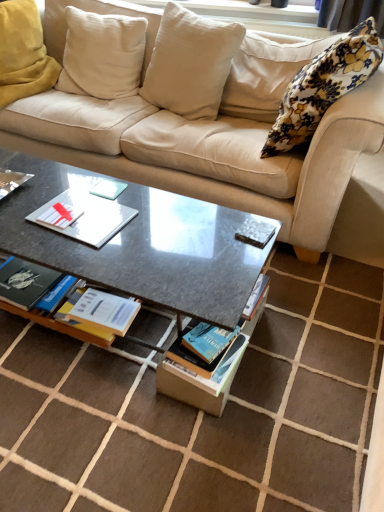
You are a GUI agent. You are given a task and a screenshot of the screen. Output one action in this format:
    pyautogui.click(x=<x>, y=<y>)
    Task: Click on the floral fabric pillow at upper right, the fourth pillow positioned from the left
    
    Given the screenshot: What is the action you would take?
    pyautogui.click(x=323, y=86)

Locate an element on the screen. This screenshot has width=384, height=512. metallic silver book at left, which is the 2th book in bottom-to-top order is located at coordinates (11, 181).

Image resolution: width=384 pixels, height=512 pixels. Describe the element at coordinates (142, 245) in the screenshot. I see `granite gray coffee table at center` at that location.

This screenshot has width=384, height=512. Describe the element at coordinates (190, 63) in the screenshot. I see `white cotton pillow at upper center, which is the 2th pillow from right to left` at that location.

You are a GUI agent. You are given a task and a screenshot of the screen. Output one action in this format:
    pyautogui.click(x=<x>, y=<y>)
    Task: Click on the white matte paper at center
    The height and width of the screenshot is (512, 384).
    Given the screenshot: What is the action you would take?
    pyautogui.click(x=84, y=217)

This screenshot has width=384, height=512. I want to click on beige fabric couch at upper center, so click(x=214, y=124).

What is the approximate height of beige cotton cushion at upper left, marked as the third pillow in a right-to-left arrangement?

The height of beige cotton cushion at upper left, marked as the third pillow in a right-to-left arrangement, is 21.34 inches.

Locate an element on the screen. This screenshot has width=384, height=512. floral fabric pillow at upper right, the fourth pillow positioned from the left is located at coordinates (323, 86).

In terms of width, does metallic silver book at left, which is the 2th book in bottom-to-top order, look wider or thinner when compared to white matte paper at center?

Considering their sizes, metallic silver book at left, which is the 2th book in bottom-to-top order, looks slimmer than white matte paper at center.

The width and height of the screenshot is (384, 512). Find the location of `paperback book on the right of metallic silver book at left, placed as the first book when sorted from top to bottom`. paperback book on the right of metallic silver book at left, placed as the first book when sorted from top to bottom is located at coordinates (84, 217).

Would you say white matte paper at center is part of metallic silver book at left, placed as the first book when sorted from top to bottom,'s contents?

No, white matte paper at center is not surrounded by metallic silver book at left, placed as the first book when sorted from top to bottom.

Which object is positioned more to the left, metallic silver book at left, which is the second book in right-to-left order, or white matte paper at center?

From the viewer's perspective, metallic silver book at left, which is the second book in right-to-left order, appears more on the left side.

Is metallic silver magazine at center, the 1th magazine viewed from the top, inside or outside of white cotton pillow at upper center, the third pillow positioned from the left?

metallic silver magazine at center, the 1th magazine viewed from the top, is outside white cotton pillow at upper center, the third pillow positioned from the left.

Does point (252, 231) come farther from viewer compared to point (187, 96)?

No, (252, 231) is closer to viewer.

Is metallic silver magazine at center, the 1th magazine viewed from the top, directly adjacent to white cotton pillow at upper center, which is the 2th pillow from right to left?

metallic silver magazine at center, the 1th magazine viewed from the top, is not next to white cotton pillow at upper center, which is the 2th pillow from right to left, and they're not touching.

Considering their positions, is metallic silver magazine at center, the 2th magazine ordered from the bottom, located in front of or behind white cotton pillow at upper center, which is the 2th pillow from right to left?

Clearly, metallic silver magazine at center, the 2th magazine ordered from the bottom, is in front of white cotton pillow at upper center, which is the 2th pillow from right to left.

Image resolution: width=384 pixels, height=512 pixels. Identify the location of book that is the 2nd object to the left of the white cotton pillow at upper center, which is the 2th pillow from right to left, starting at the anchor. (11, 181).

Is metallic silver book at left, which is the second book in right-to-left order, turned away from white cotton pillow at upper center, which is the 2th pillow from right to left?

metallic silver book at left, which is the second book in right-to-left order, is not turned away from white cotton pillow at upper center, which is the 2th pillow from right to left.

From the image's perspective, relative to white cotton pillow at upper center, the third pillow positioned from the left, is metallic silver book at left, which is the 2th book in bottom-to-top order, above or below?

metallic silver book at left, which is the 2th book in bottom-to-top order, is below white cotton pillow at upper center, the third pillow positioned from the left.

Is granite gray coffee table at center oriented towards hardcover book at center, acting as the second book starting from the left?

Yes.

Is point (254, 251) positioned in front of point (91, 330)?

That is True.

Which of these two, granite gray coffee table at center or hardcover book at center, the first book positioned from the right, is smaller?

hardcover book at center, the first book positioned from the right.

This screenshot has width=384, height=512. In the image, there is a granite gray coffee table at center. What are the coordinates of `book below it (from a real-world perspective)` in the screenshot? It's located at (62, 322).

Is hardcover book at center, acting as the second book starting from the top, touching soft white cushion at upper left, the first pillow when ordered from left to right?

There is a gap between hardcover book at center, acting as the second book starting from the top, and soft white cushion at upper left, the first pillow when ordered from left to right.

From the picture: Which object is more forward, hardcover book at center, the first book positioned from the right, or soft white cushion at upper left, the first pillow when ordered from left to right?

hardcover book at center, the first book positioned from the right.

From their relative heights in the image, would you say hardcover book at center, acting as the second book starting from the top, is taller or shorter than soft white cushion at upper left, the first pillow when ordered from left to right?

hardcover book at center, acting as the second book starting from the top, is shorter than soft white cushion at upper left, the first pillow when ordered from left to right.

Is hardcover book at center, which is the first book from bottom to top, oriented towards soft white cushion at upper left, the first pillow when ordered from left to right?

No, hardcover book at center, which is the first book from bottom to top, is not facing towards soft white cushion at upper left, the first pillow when ordered from left to right.

Who is shorter, granite gray coffee table at center or white cotton pillow at upper center, which is the 2th pillow from right to left?

With less height is granite gray coffee table at center.

Looking at this image, who is smaller, granite gray coffee table at center or white cotton pillow at upper center, which is the 2th pillow from right to left?

white cotton pillow at upper center, which is the 2th pillow from right to left.

Is granite gray coffee table at center completely or partially outside of white cotton pillow at upper center, which is the 2th pillow from right to left?

Yes.

Would you say granite gray coffee table at center is to the left or to the right of white cotton pillow at upper center, which is the 2th pillow from right to left, in the picture?

From the image, it's evident that granite gray coffee table at center is to the left of white cotton pillow at upper center, which is the 2th pillow from right to left.

Is white cotton pillow at upper center, the third pillow positioned from the left, located outside granite gray coffee table at center?

white cotton pillow at upper center, the third pillow positioned from the left, lies outside granite gray coffee table at center's area.

Who is bigger, white cotton pillow at upper center, the third pillow positioned from the left, or granite gray coffee table at center?

Bigger between the two is granite gray coffee table at center.

Considering the relative positions of white cotton pillow at upper center, the third pillow positioned from the left, and granite gray coffee table at center in the image provided, is white cotton pillow at upper center, the third pillow positioned from the left, in front of granite gray coffee table at center?

No, it is behind granite gray coffee table at center.

Considering the sizes of objects white cotton pillow at upper center, the third pillow positioned from the left, and granite gray coffee table at center in the image provided, who is shorter, white cotton pillow at upper center, the third pillow positioned from the left, or granite gray coffee table at center?

With less height is granite gray coffee table at center.

In order to click on paperback book below the metallic silver book at left, placed as the first book when sorted from top to bottom (from the image's perspective) in this screenshot , I will do `click(84, 217)`.

Where is `the 1st pillow counting from the left of the metallic silver magazine at center, the 2th magazine ordered from the bottom`? The image size is (384, 512). the 1st pillow counting from the left of the metallic silver magazine at center, the 2th magazine ordered from the bottom is located at coordinates coord(190,63).

Looking at this image, which object lies further to the anchor point beige fabric couch at upper center, floral fabric pillow at upper right, the fourth pillow positioned from the left, or beige cotton cushion at upper left, arranged as the 2th pillow when viewed from the left?

The object further to beige fabric couch at upper center is floral fabric pillow at upper right, the fourth pillow positioned from the left.

Based on their spatial positions, is metallic silver book at left, which is the second book in right-to-left order, or beige fabric couch at upper center closer to metallic silver magazine at center, the 1th magazine viewed from the top?

metallic silver book at left, which is the second book in right-to-left order, is closer to metallic silver magazine at center, the 1th magazine viewed from the top.

Looking at the image, which one is located closer to floral fabric pillow at upper right, the fourth pillow positioned from the left, metallic silver book at left, which is the 2th book in bottom-to-top order, or beige fabric couch at upper center?

beige fabric couch at upper center.

Looking at the image, which one is located further to beige fabric couch at upper center, granite gray coffee table at center or metallic silver book at left, which ranks as the first book in left-to-right order?

metallic silver book at left, which ranks as the first book in left-to-right order, is positioned further to the anchor beige fabric couch at upper center.

When comparing their distances from blue matte book at center, which is the 1th magazine from bottom to top, does white cotton pillow at upper center, which is the 2th pillow from right to left, or metallic silver book at left, which is the 2th book in bottom-to-top order, seem closer?

Among the two, metallic silver book at left, which is the 2th book in bottom-to-top order, is located nearer to blue matte book at center, which is the 1th magazine from bottom to top.

Which object lies nearer to the anchor point metallic silver book at left, which is the second book in right-to-left order, blue matte book at center, placed as the 2th magazine when sorted from top to bottom, or white cotton pillow at upper center, the third pillow positioned from the left?

blue matte book at center, placed as the 2th magazine when sorted from top to bottom, is closer to metallic silver book at left, which is the second book in right-to-left order.

Based on their spatial positions, is granite gray coffee table at center or floral fabric pillow at upper right, positioned as the first pillow in right-to-left order, further from blue matte book at center, placed as the 2th magazine when sorted from top to bottom?

floral fabric pillow at upper right, positioned as the first pillow in right-to-left order, is positioned further to the anchor blue matte book at center, placed as the 2th magazine when sorted from top to bottom.

Which object lies further to the anchor point granite gray coffee table at center, floral fabric pillow at upper right, the fourth pillow positioned from the left, or metallic silver magazine at center, the 2th magazine ordered from the bottom?

floral fabric pillow at upper right, the fourth pillow positioned from the left, lies further to granite gray coffee table at center than the other object.

The width and height of the screenshot is (384, 512). Find the location of `studio couch between white cotton pillow at upper center, which is the 2th pillow from right to left, and hardcover book at center, acting as the second book starting from the left, from top to bottom`. studio couch between white cotton pillow at upper center, which is the 2th pillow from right to left, and hardcover book at center, acting as the second book starting from the left, from top to bottom is located at coordinates (214, 124).

Image resolution: width=384 pixels, height=512 pixels. Find the location of `book situated between metallic silver book at left, which is the 2th book in bottom-to-top order, and blue matte book at center, placed as the 2th magazine when sorted from top to bottom, from left to right`. book situated between metallic silver book at left, which is the 2th book in bottom-to-top order, and blue matte book at center, placed as the 2th magazine when sorted from top to bottom, from left to right is located at coordinates (62, 322).

Identify the location of book located between metallic silver book at left, which is the 2th book in bottom-to-top order, and floral fabric pillow at upper right, positioned as the first pillow in right-to-left order, in the left-right direction. This screenshot has width=384, height=512. (62, 322).

Identify the location of studio couch between metallic silver book at left, which ranks as the first book in left-to-right order, and metallic silver magazine at center, the 1th magazine viewed from the top, in the horizontal direction. Image resolution: width=384 pixels, height=512 pixels. (214, 124).